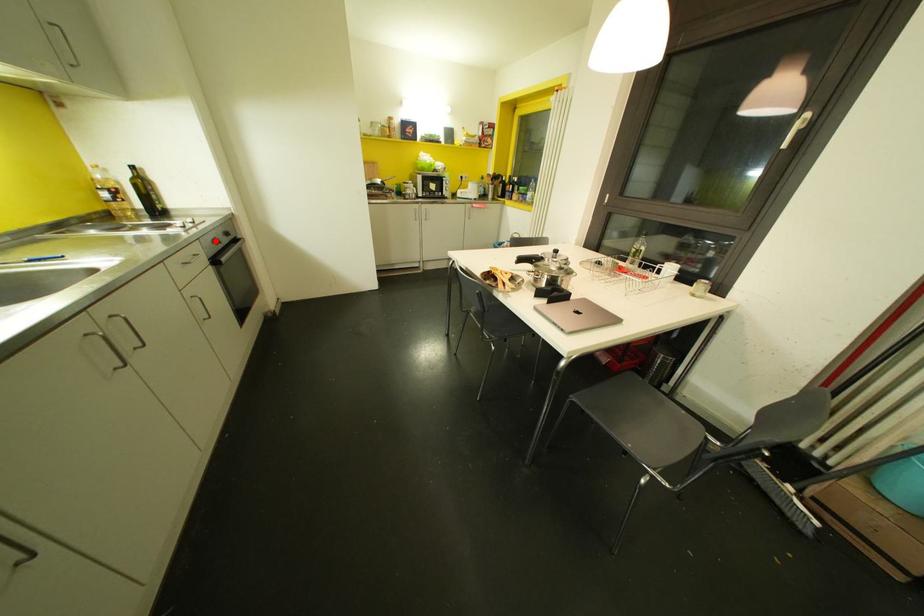
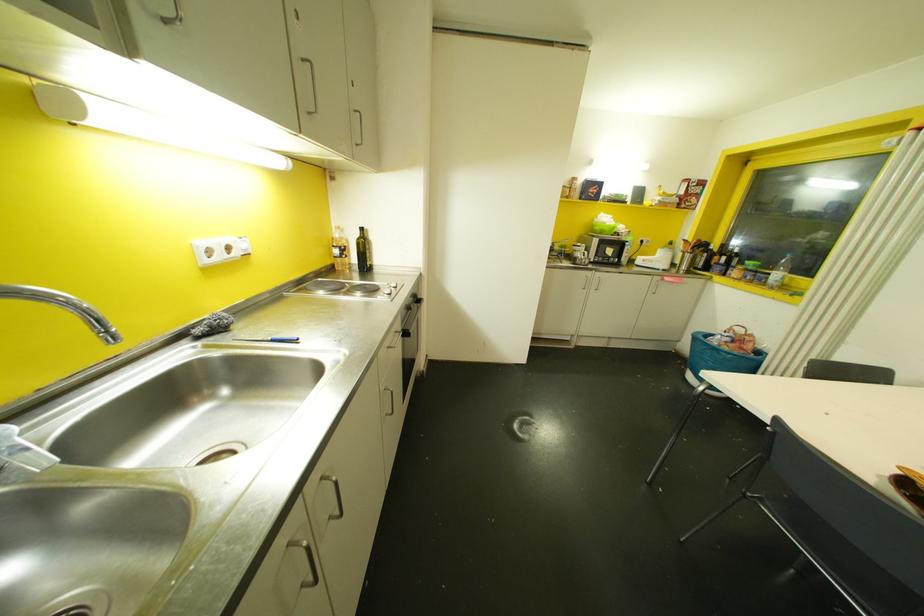
Find the pixel in the second image that matches the highlighted location in the first image.

(407, 307)